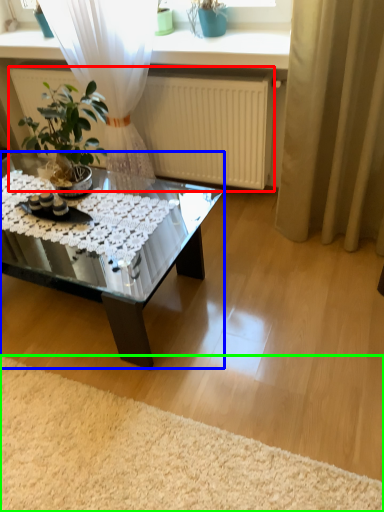
Question: Considering the real-world distances, which object is farthest from radiator (highlighted by a red box)? coffee table (highlighted by a blue box) or plain (highlighted by a green box)?

Choices:
 (A) coffee table
 (B) plain

Answer: (B)